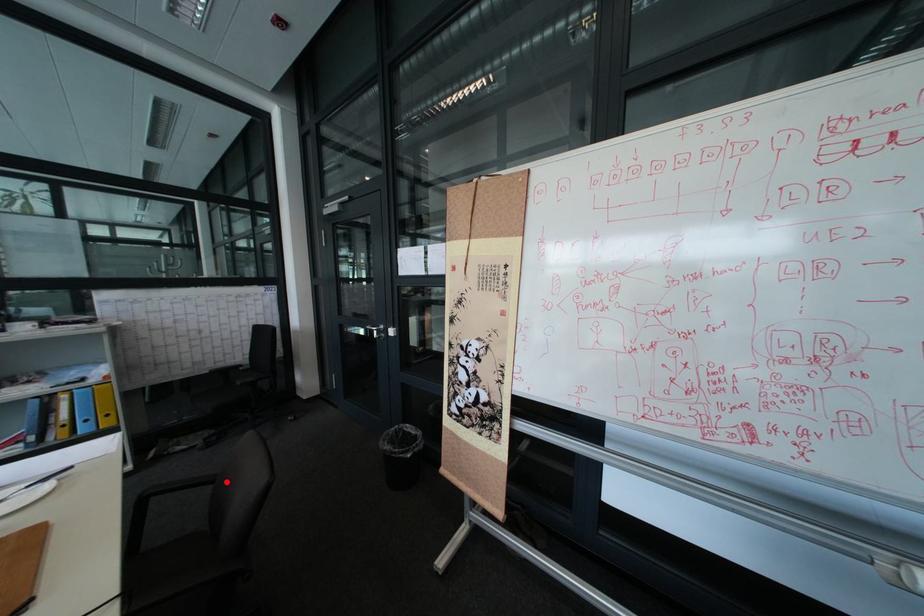
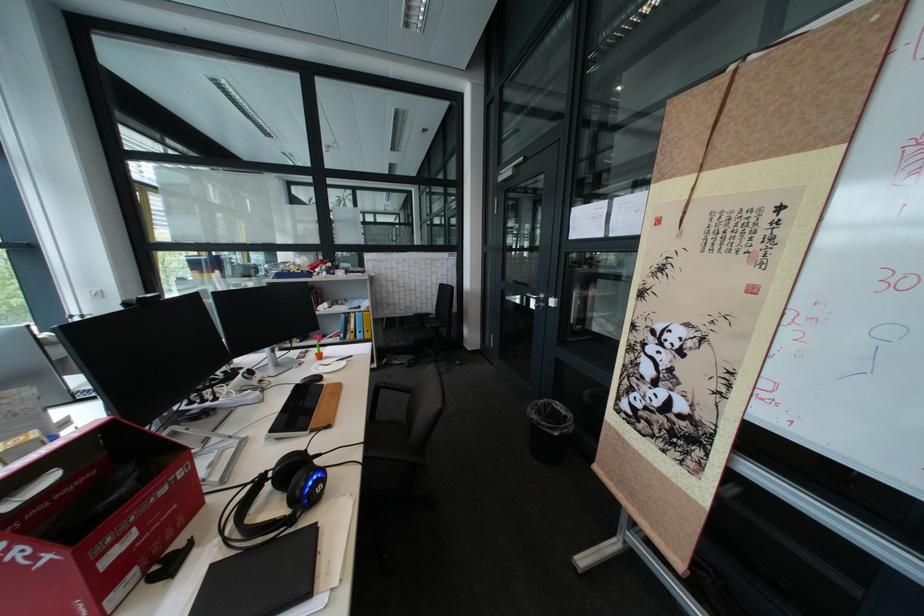
Question: I am providing you with two images of the same scene from different viewpoints. Image1 has a red point marked. In image2, the corresponding 3D location appears at what relative position? Reply with the corresponding letter.

Choices:
 (A) Closer
 (B) Farther

Answer: (B)